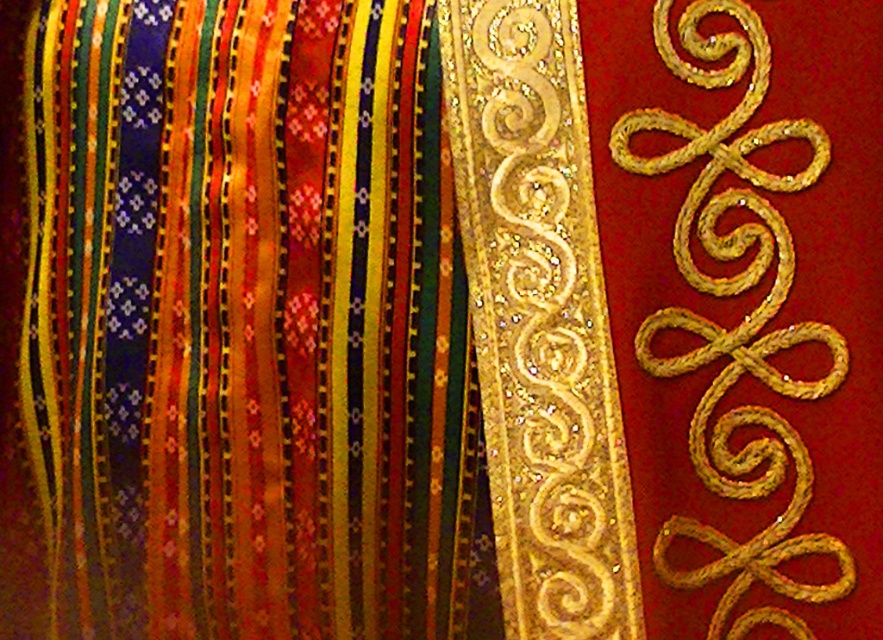
Can you confirm if shiny metallic ribbons at left is taller than gold glittery swirls at right?

Correct, shiny metallic ribbons at left is much taller as gold glittery swirls at right.

Who is more distant from viewer, (x=280, y=339) or (x=804, y=554)?

The point (x=280, y=339) is more distant.

Is point (261, 221) closer to camera compared to point (650, 452)?

No, (261, 221) is further to viewer.

Find the location of a particular element. shiny metallic ribbons at left is located at coordinates (238, 326).